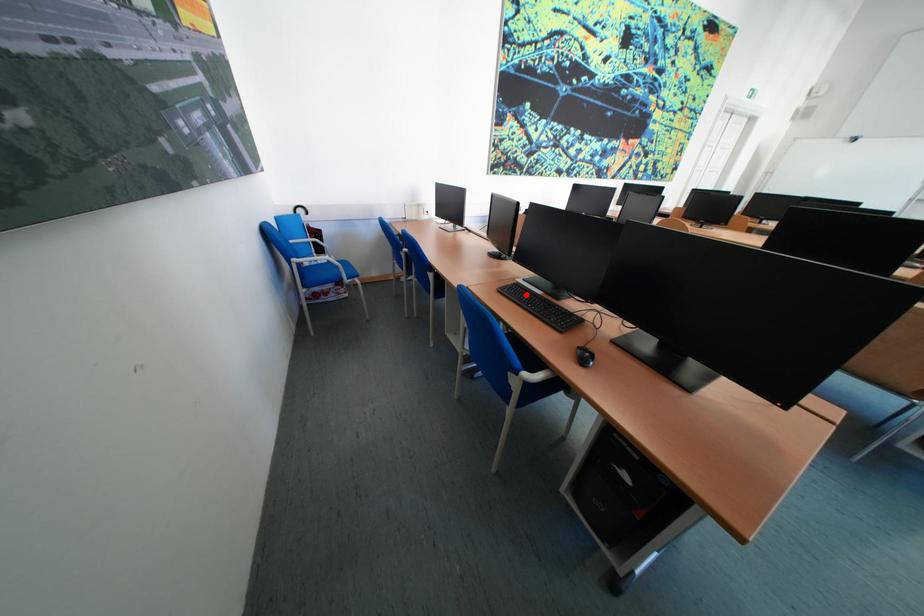
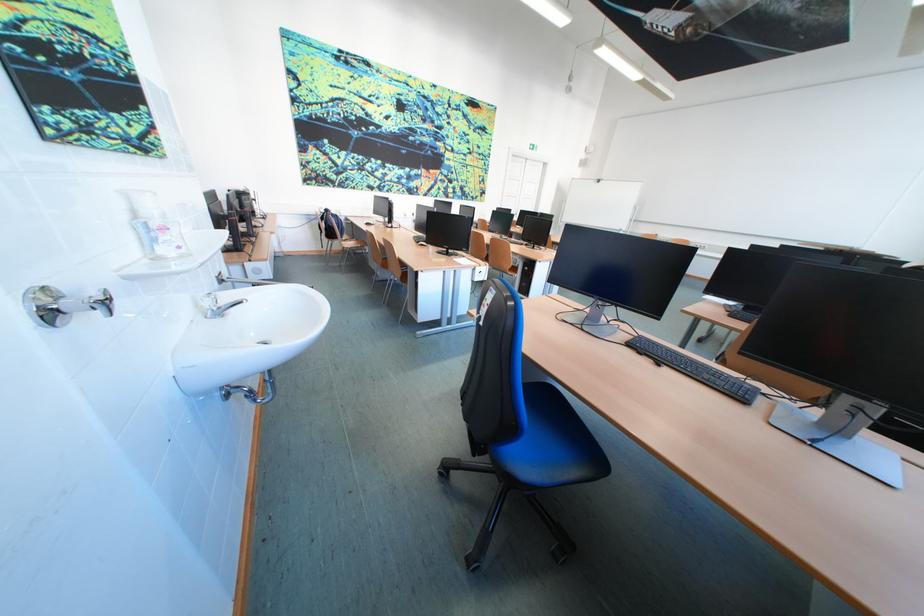
Question: I am providing you with two images of the same scene from different viewpoints. A red point is marked on the first image. Is the red point's position out of view in image 2?

Choices:
 (A) Yes
 (B) No

Answer: (A)